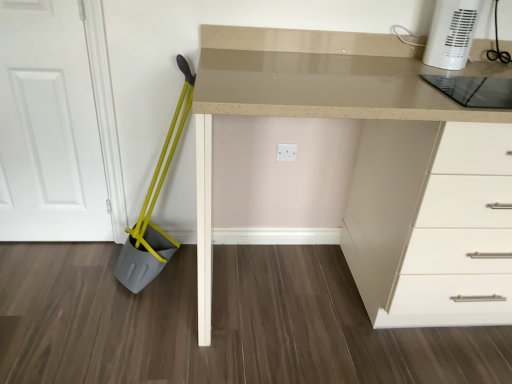
Identify the location of vacant region to the right of yellow plastic shovel at left. Image resolution: width=512 pixels, height=384 pixels. (236, 279).